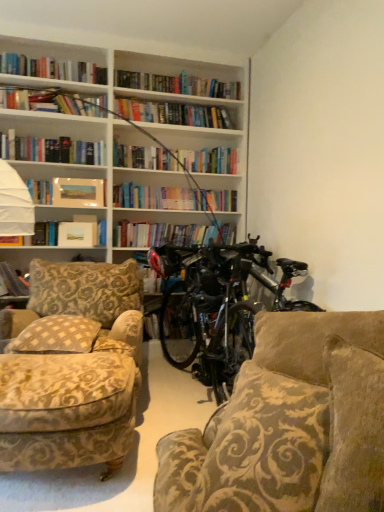
Question: Considering the positions of shiny black bicycle at center and matte paper paperback book at upper left in the image, is shiny black bicycle at center wider or thinner than matte paper paperback book at upper left?

Choices:
 (A) wide
 (B) thin

Answer: (A)

Question: From a real-world perspective, is shiny black bicycle at center positioned above or below matte paper paperback book at upper left?

Choices:
 (A) below
 (B) above

Answer: (A)

Question: Estimate the real-world distances between objects in this image. Which object is farther from the beige checkered pillow at left?

Choices:
 (A) velvet-patterned couch at right
 (B) matte paper paperback book at upper left
 (C) matte paper photo frame at upper left, the 2th book in the bottom-to-top sequence
 (D) velvet beige armchair at lower left
 (E) shiny black bicycle at center

Answer: (C)

Question: Considering the real-world distances, which object is farthest from the matte paper paperback book at upper left?

Choices:
 (A) velvet-patterned couch at right
 (B) hardcover book at left, the first book in the left-to-right sequence
 (C) beige checkered pillow at left
 (D) matte paper photo frame at upper left, placed as the 2th book when sorted from left to right
 (E) velvet beige armchair at lower left

Answer: (A)